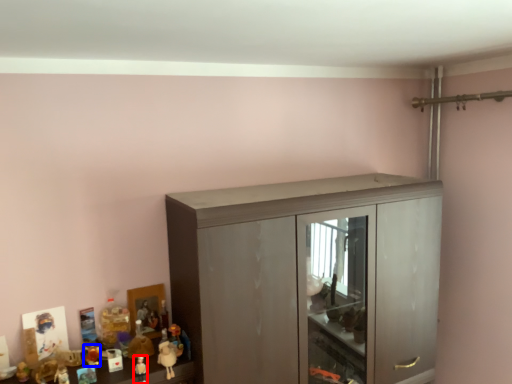
Question: Which object is closer to the camera taking this photo, toy (highlighted by a red box) or toy (highlighted by a blue box)?

Choices:
 (A) toy
 (B) toy

Answer: (A)